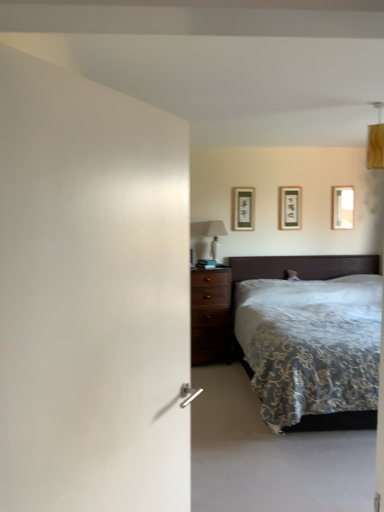
Question: Which direction should I rotate to look at matte black picture frame at upper center, the 2th picture frame positioned from the right?

Choices:
 (A) left
 (B) right

Answer: (B)

Question: Does velvet dark brown bed at right turn towards matte black picture frame at upper center, the third picture frame in the right-to-left sequence?

Choices:
 (A) yes
 (B) no

Answer: (B)

Question: Is velvet dark brown bed at right closer to camera compared to matte black picture frame at upper center, which ranks as the first picture frame in left-to-right order?

Choices:
 (A) yes
 (B) no

Answer: (A)

Question: Does velvet dark brown bed at right have a larger size compared to matte black picture frame at upper center, which ranks as the first picture frame in left-to-right order?

Choices:
 (A) no
 (B) yes

Answer: (B)

Question: Considering the relative sizes of velvet dark brown bed at right and matte black picture frame at upper center, which ranks as the first picture frame in left-to-right order, in the image provided, is velvet dark brown bed at right smaller than matte black picture frame at upper center, which ranks as the first picture frame in left-to-right order,?

Choices:
 (A) no
 (B) yes

Answer: (A)

Question: Is velvet dark brown bed at right surrounding matte black picture frame at upper center, which ranks as the first picture frame in left-to-right order?

Choices:
 (A) yes
 (B) no

Answer: (B)

Question: Is velvet dark brown bed at right behind matte black picture frame at upper center, the third picture frame in the right-to-left sequence?

Choices:
 (A) yes
 (B) no

Answer: (B)

Question: Would you consider white glossy table lamp at upper center to be distant from velvet dark brown bed at right?

Choices:
 (A) yes
 (B) no

Answer: (B)

Question: Considering the relative positions of white glossy table lamp at upper center and velvet dark brown bed at right in the image provided, is white glossy table lamp at upper center to the left of velvet dark brown bed at right from the viewer's perspective?

Choices:
 (A) yes
 (B) no

Answer: (A)

Question: Is white glossy table lamp at upper center to the right of velvet dark brown bed at right from the viewer's perspective?

Choices:
 (A) no
 (B) yes

Answer: (A)

Question: Is white glossy table lamp at upper center looking in the opposite direction of velvet dark brown bed at right?

Choices:
 (A) no
 (B) yes

Answer: (A)

Question: Is the depth of white glossy table lamp at upper center greater than that of velvet dark brown bed at right?

Choices:
 (A) no
 (B) yes

Answer: (B)

Question: Does white glossy table lamp at upper center have a lesser width compared to velvet dark brown bed at right?

Choices:
 (A) no
 (B) yes

Answer: (B)

Question: Is matte black picture frame at upper center, the second picture frame in the left-to-right sequence, not close to velvet dark brown bed at right?

Choices:
 (A) yes
 (B) no

Answer: (B)